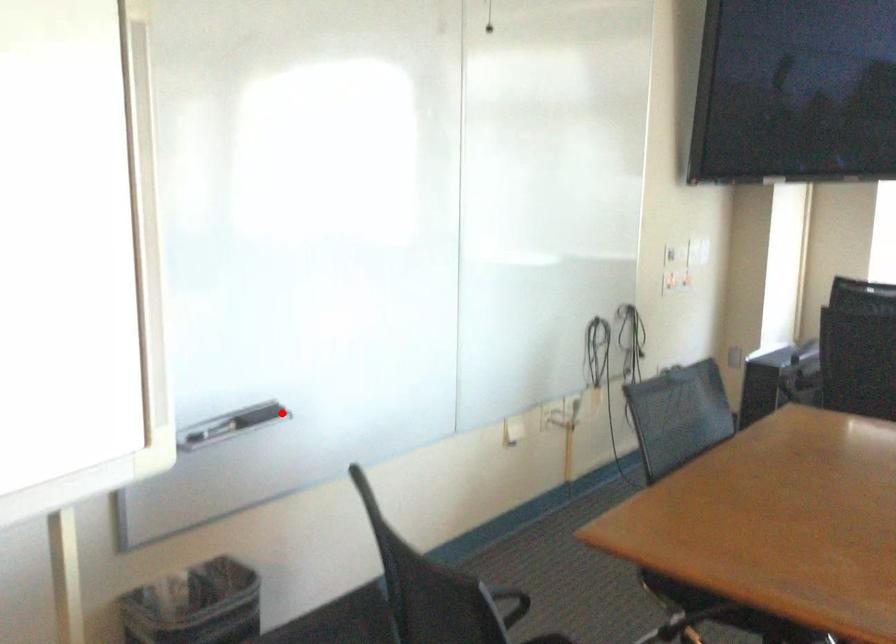
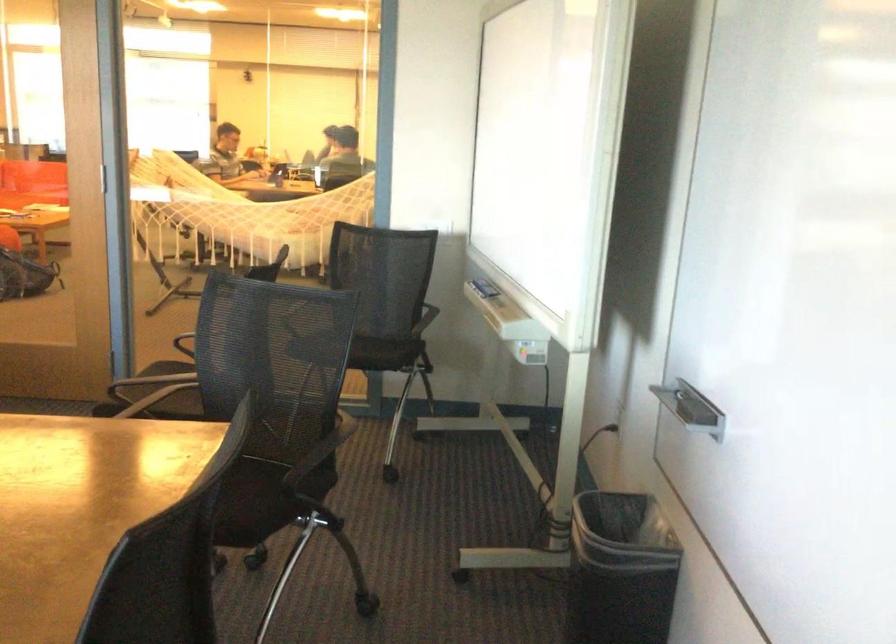
Find the pixel in the second image that matches the highlighted location in the first image.

(691, 408)